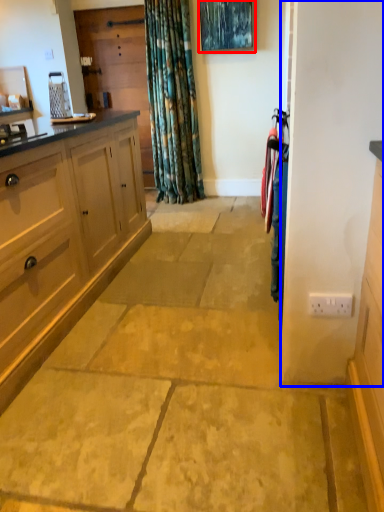
Question: Among these objects, which one is farthest to the camera, picture frame (highlighted by a red box) or screen door (highlighted by a blue box)?

Choices:
 (A) picture frame
 (B) screen door

Answer: (A)